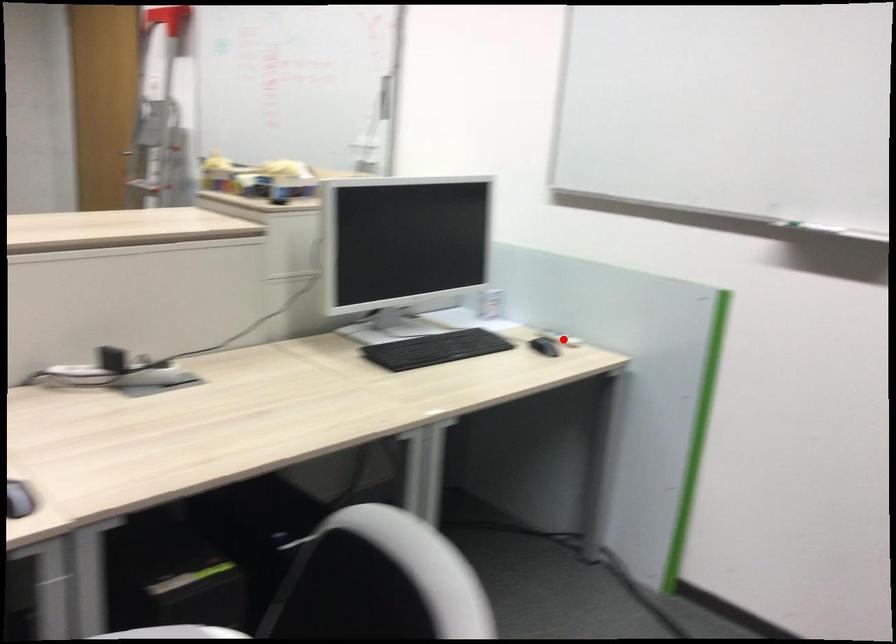
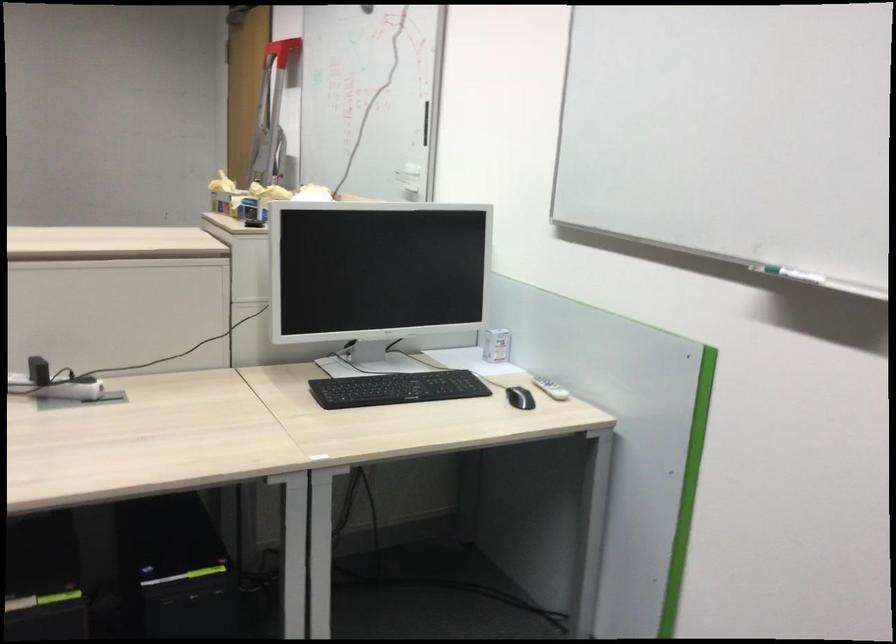
Question: I am providing you with two images of the same scene from different viewpoints. Given a red point in image1, look at the same physical point in image2. Is it:

Choices:
 (A) Closer to the viewpoint
 (B) Farther from the viewpoint

Answer: (A)